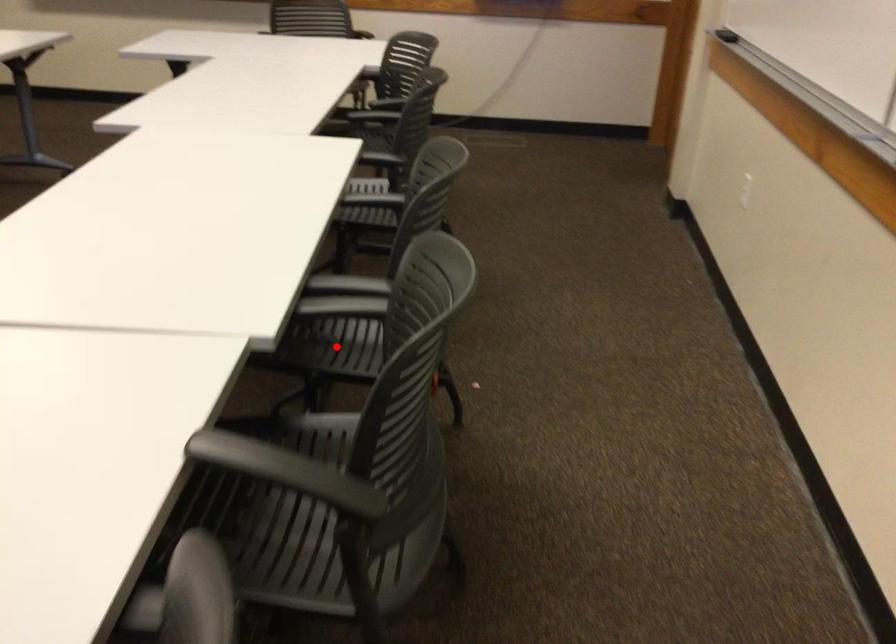
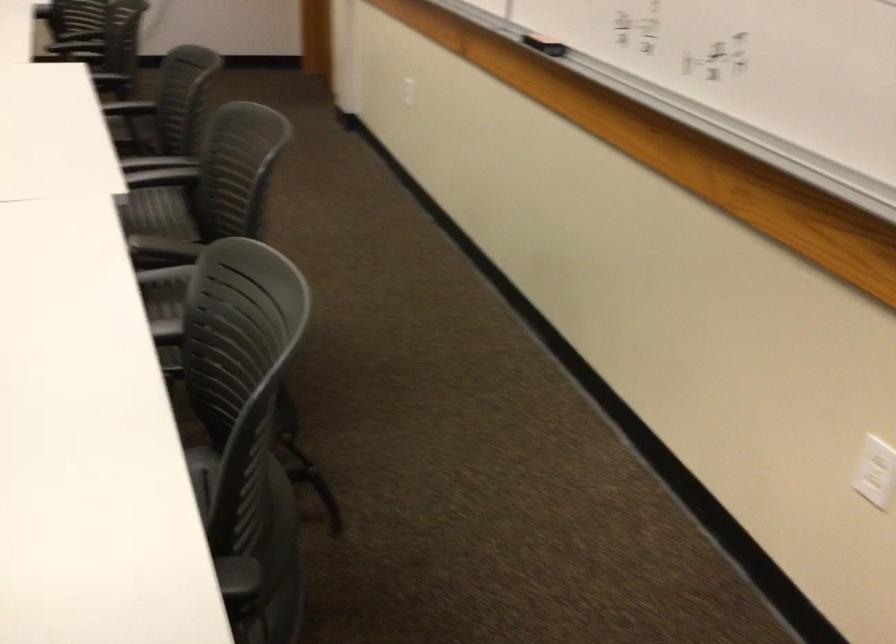
Question: I am providing you with two images of the same scene from different viewpoints. A red point is marked on the first image. At the location where the point appears in image 1, is it still visible in image 2?

Choices:
 (A) Yes
 (B) No

Answer: (B)